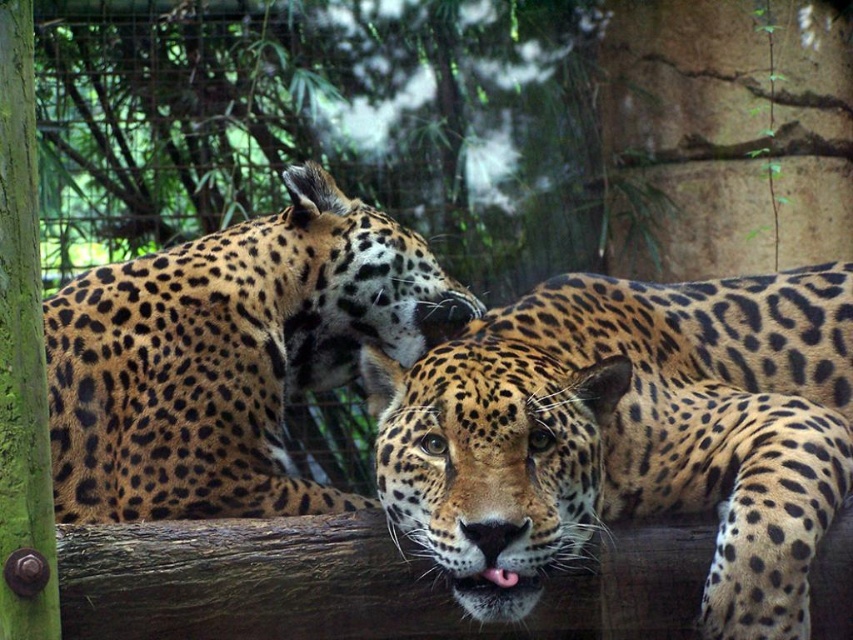
You are a zookeeper observing the jaguars in their enclosure. You notice two jaguars with spotted fur. Which jaguar, the spotted fur leopard at center or the spotted fur leopard at upper left, is shorter in height?

The spotted fur leopard at center is not as tall as the spotted fur leopard at upper left, so the one at center is shorter.

You are a zookeeper observing two jaguars in their enclosure. You notice the spotted fur leopard at center and the spotted fur leopard at upper left. Which jaguar is positioned to the right side of the other?

The spotted fur leopard at center is to the right of the spotted fur leopard at upper left.

You are a zookeeper standing at the camera position. You need to throw a treat to the jaguar at point (426,452). Can you reach it with a throw of 3 meters?

The distance between the camera and point (426,452) is 3.25 meters, so a 3 meter throw would not be enough to reach the jaguar at point (426,452).